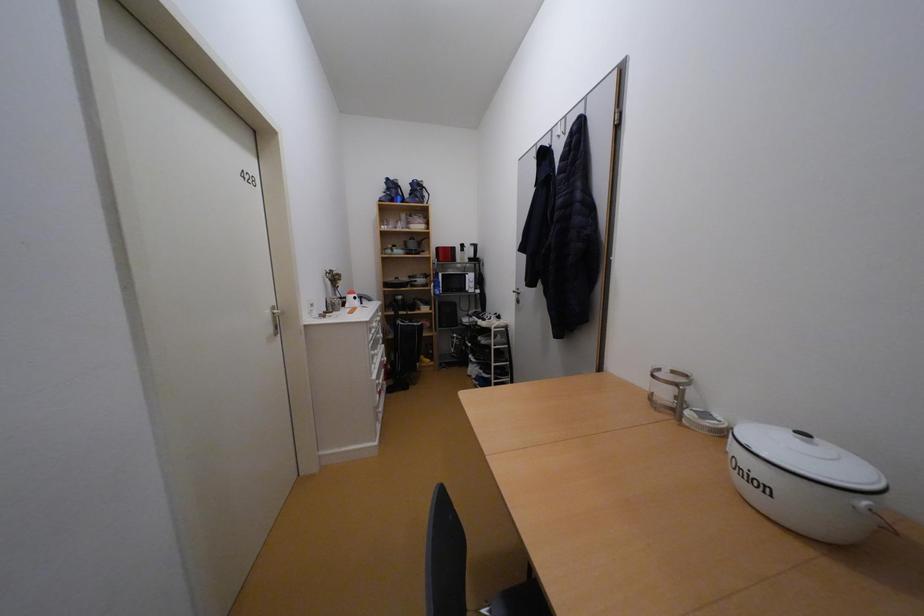
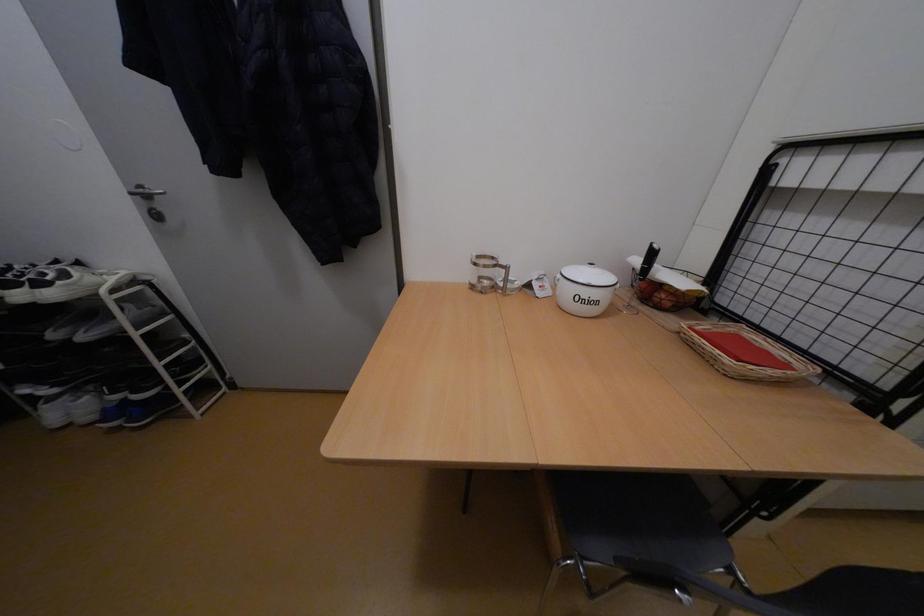
How did the camera likely rotate?

The camera rotated toward right-down.